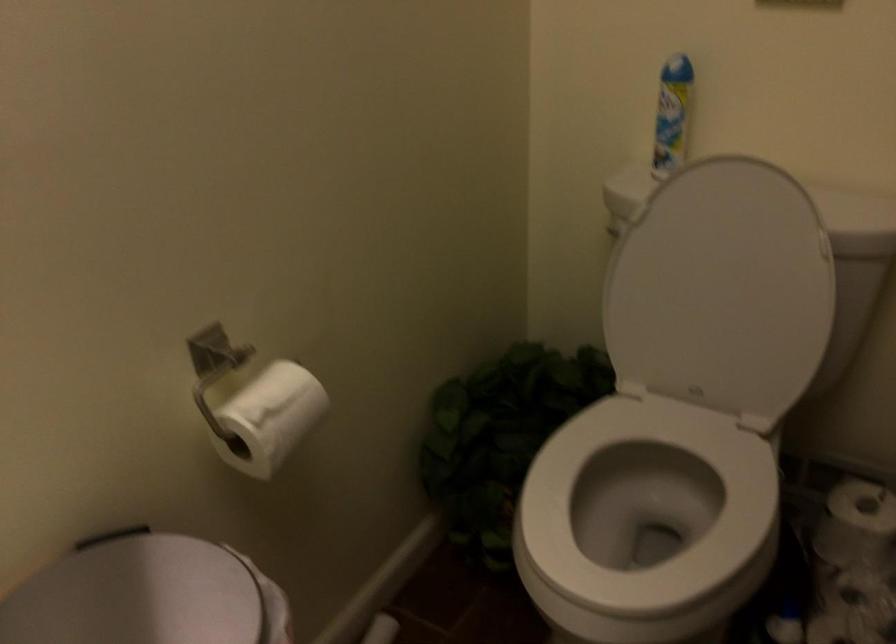
Identify the location of white toilet seat. The image size is (896, 644). (645, 516).